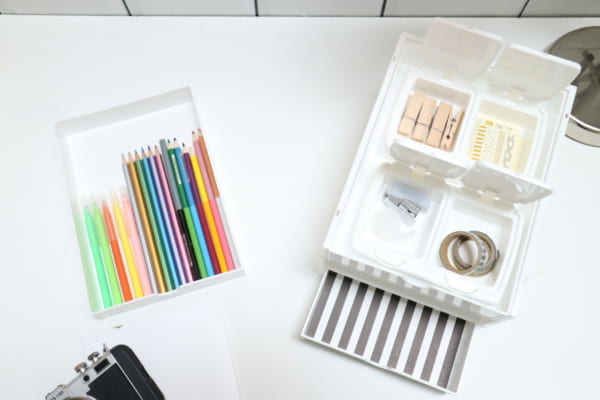
You are a GUI agent. You are given a task and a screenshot of the screen. Output one action in this format:
    pyautogui.click(x=<x>, y=<y>)
    Task: Click on the compartments
    
    Given the screenshot: What is the action you would take?
    pyautogui.click(x=440, y=105), pyautogui.click(x=512, y=135), pyautogui.click(x=477, y=259), pyautogui.click(x=384, y=222), pyautogui.click(x=363, y=330)